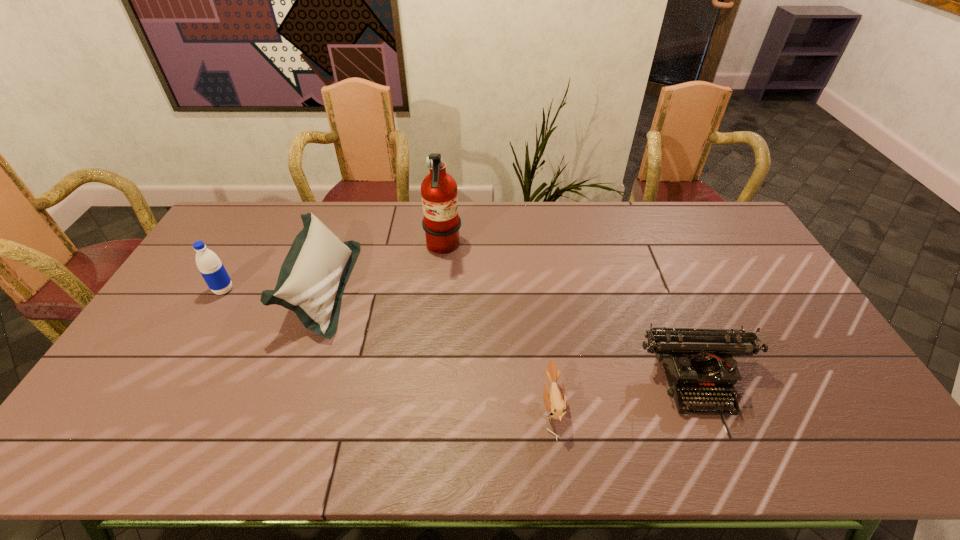
The height and width of the screenshot is (540, 960). Identify the location of vacant space at the right edge of the desktop. (804, 326).

Image resolution: width=960 pixels, height=540 pixels. Find the location of `blank space at the far left corner`. blank space at the far left corner is located at coordinates (247, 215).

Where is `vacant space at the far right corner of the desktop`? vacant space at the far right corner of the desktop is located at coordinates (738, 234).

Locate an element on the screen. free space between the water bottle and the fourth object from right to left is located at coordinates (273, 289).

Where is `free space between the second object from right to left and the tallest object`? free space between the second object from right to left and the tallest object is located at coordinates click(x=497, y=327).

Locate an element on the screen. The image size is (960, 540). vacant area that lies between the fourth tallest object and the third object from right to left is located at coordinates (570, 314).

At what (x,y) coordinates should I click in order to perform the action: click on empty location between the fourth object from left to right and the second object from left to right. Please return your answer as a coordinate pair (x, y). This screenshot has height=540, width=960. Looking at the image, I should click on (438, 348).

This screenshot has width=960, height=540. Identify the location of empty space between the shortest object and the tallest object. (497, 327).

Image resolution: width=960 pixels, height=540 pixels. I want to click on vacant area that lies between the fourth tallest object and the cushion, so click(x=510, y=334).

Where is `object that ranks as the third closest to the fire extinguisher`? object that ranks as the third closest to the fire extinguisher is located at coordinates tap(695, 361).